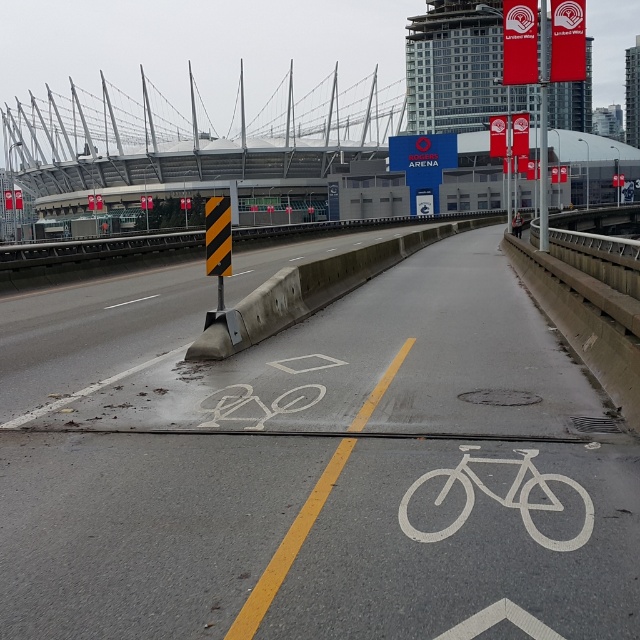
Can you confirm if white painted bicycle lane at center is positioned to the right of metallic silver bicycle at center?

In fact, white painted bicycle lane at center is to the left of metallic silver bicycle at center.

In the scene shown: Is the position of white painted bicycle lane at center more distant than that of metallic silver bicycle at center?

No, it is not.

Which is behind, point (344, 404) or point (520, 216)?

The point (520, 216) is more distant.

Where is `white painted bicycle lane at center`? white painted bicycle lane at center is located at coordinates (x=312, y=467).

Between point (323, 109) and point (512, 220), which one is positioned behind?

Positioned behind is point (323, 109).

In the scene shown: Between concrete bridge at upper center and metallic silver bicycle at center, which one appears on the left side from the viewer's perspective?

From the viewer's perspective, concrete bridge at upper center appears more on the left side.

Does point (307, 108) lie in front of point (516, 221)?

That is False.

Find the location of a particular element. This screenshot has width=640, height=640. concrete bridge at upper center is located at coordinates (193, 136).

Between concrete bridge at upper center and yellow/black striped sign at center, which one appears on the right side from the viewer's perspective?

Positioned to the right is yellow/black striped sign at center.

Between point (140, 172) and point (228, 244), which one is positioned behind?

The point (140, 172) is more distant.

Identify the location of concrete bridge at upper center. (193, 136).

Locate an element on the screen. concrete bridge at upper center is located at coordinates (193, 136).